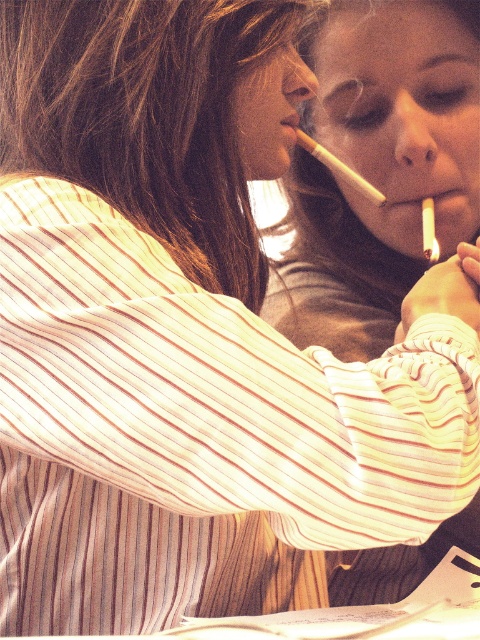
Does white matte cigarette at center have a greater height compared to white matte cigarette at upper right?

Yes, white matte cigarette at center is taller than white matte cigarette at upper right.

Where is `white matte cigarette at center`? This screenshot has width=480, height=640. white matte cigarette at center is located at coordinates (339, 168).

Does white matte cigarette at upper right appear under matte yellow cigarette at center?

Indeed, white matte cigarette at upper right is positioned under matte yellow cigarette at center.

This screenshot has width=480, height=640. I want to click on white matte cigarette at upper right, so click(x=429, y=230).

Locate an element on the screen. white matte cigarette at upper right is located at coordinates (429, 230).

Is point (444, 228) positioned after point (427, 196)?

That is True.

In the scene shown: Who is positioned more to the right, matte gray shirt at center or white matte cigarette at upper right?

white matte cigarette at upper right

This screenshot has width=480, height=640. In order to click on matte gray shirt at center in this screenshot , I will do `click(377, 168)`.